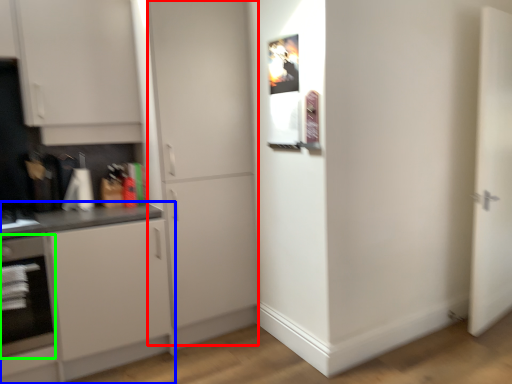
Question: Considering the real-world distances, which object is farthest from door (highlighted by a red box)? cabinetry (highlighted by a blue box) or oven (highlighted by a green box)?

Choices:
 (A) cabinetry
 (B) oven

Answer: (B)